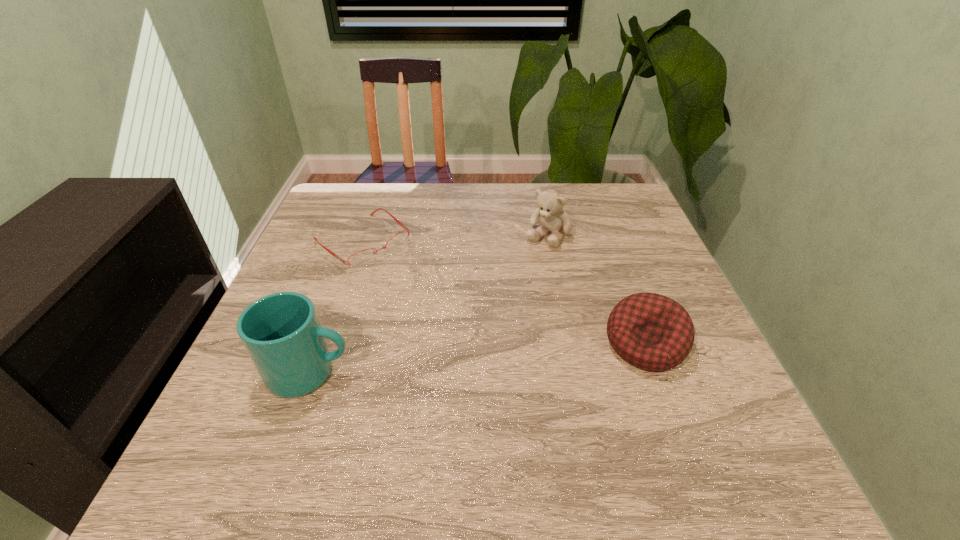
What are the coordinates of `object that is positioned at the near left corner` in the screenshot? It's located at (281, 332).

In the image, there is a desktop. Identify the location of vacant area at the far edge. (515, 184).

Where is `free space at the near edge of the desktop`? free space at the near edge of the desktop is located at coordinates tap(379, 402).

Identify the location of free space at the left edge of the desktop. The width and height of the screenshot is (960, 540). (336, 265).

The width and height of the screenshot is (960, 540). I want to click on free space at the far left corner, so click(x=333, y=204).

I want to click on free space that is in between the rightmost object and the cup, so click(x=477, y=358).

Identify the location of unoccupied area between the beanbag and the second object from right to left. (596, 289).

Locate an element on the screen. vacant space that's between the spectacles and the third object from left to right is located at coordinates (455, 239).

Find the location of a particular element. The height and width of the screenshot is (540, 960). free space between the teddy bear and the second shortest object is located at coordinates (596, 289).

Identify the location of vacant region between the cup and the shortest object. (336, 307).